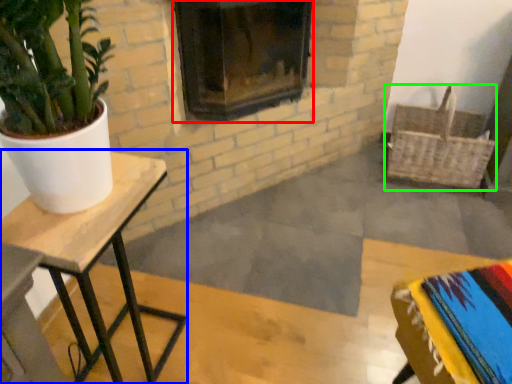
Question: Estimate the real-world distances between objects in this image. Which object is closer to fireplace (highlighted by a red box), table (highlighted by a blue box) or basket (highlighted by a green box)?

Choices:
 (A) table
 (B) basket

Answer: (B)